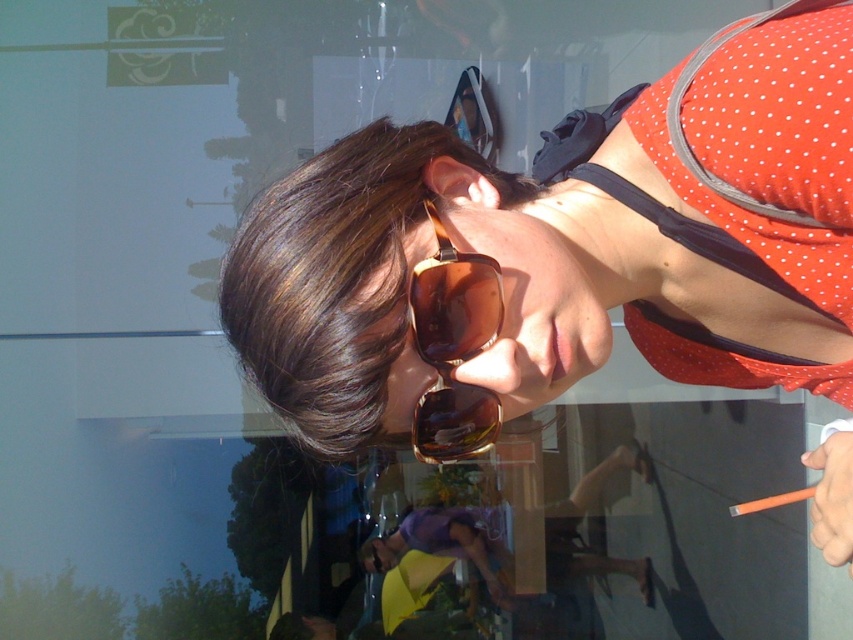
Question: Can you confirm if matte gold sunglasses at upper center is positioned above brown shiny hair at center?

Choices:
 (A) yes
 (B) no

Answer: (B)

Question: Can you confirm if brown shiny hair at center is positioned above brown matte sunglasses at center?

Choices:
 (A) yes
 (B) no

Answer: (A)

Question: Which point is closer to the camera?

Choices:
 (A) matte gold sunglasses at upper center
 (B) brown matte sunglasses at center

Answer: (A)

Question: Which point appears farthest from the camera in this image?

Choices:
 (A) (474, 397)
 (B) (254, 227)

Answer: (A)

Question: Is matte gold sunglasses at upper center bigger than brown shiny hair at center?

Choices:
 (A) yes
 (B) no

Answer: (A)

Question: Estimate the real-world distances between objects in this image. Which object is closer to the brown shiny hair at center?

Choices:
 (A) brown matte sunglasses at center
 (B) matte gold sunglasses at upper center

Answer: (B)